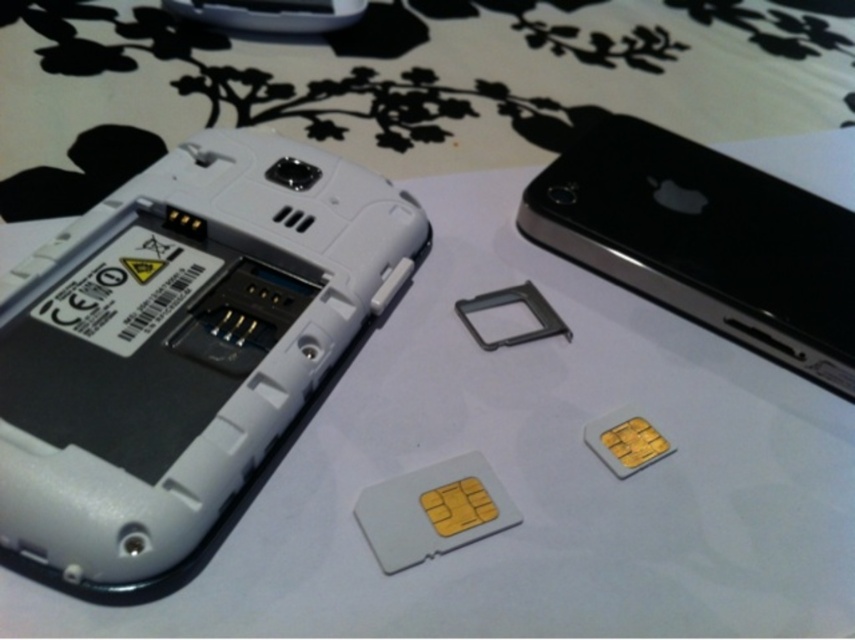
Question: Can you confirm if white plastic smartphone at upper left is wider than black glossy smartphone at upper right?

Choices:
 (A) no
 (B) yes

Answer: (B)

Question: Considering the relative positions of white plastic smartphone at upper left and black glossy smartphone at upper right in the image provided, where is white plastic smartphone at upper left located with respect to black glossy smartphone at upper right?

Choices:
 (A) right
 (B) left

Answer: (B)

Question: Which point is farther to the camera?

Choices:
 (A) black glossy smartphone at upper right
 (B) white plastic smartphone at upper left

Answer: (A)

Question: Is white plastic smartphone at upper left positioned before black glossy smartphone at upper right?

Choices:
 (A) no
 (B) yes

Answer: (B)